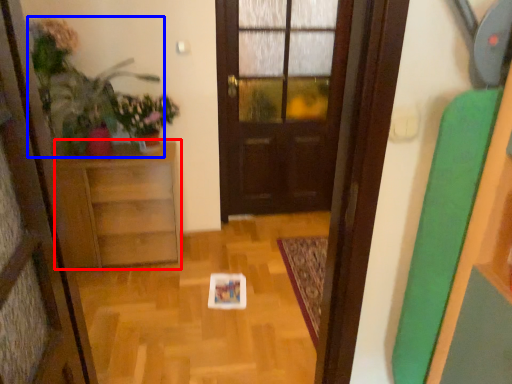
Question: Which of the following is the farthest to the observer, furniture (highlighted by a red box) or plant (highlighted by a blue box)?

Choices:
 (A) furniture
 (B) plant

Answer: (A)